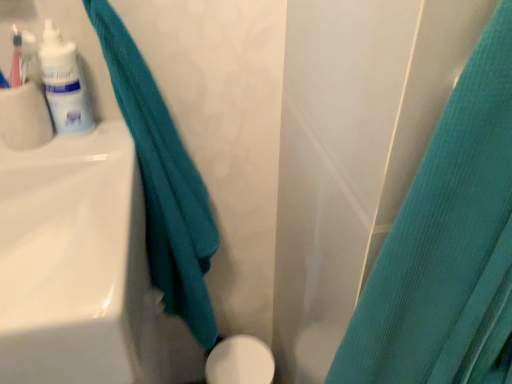
The image size is (512, 384). Identify the location of teal fabric towel at left, the 1th curtain positioned from the left. (163, 183).

Consider the image. Could you measure the distance between teal fabric curtain at right, which is the 2th curtain from left to right, and white glossy porcelain at lower center?

teal fabric curtain at right, which is the 2th curtain from left to right, is 66.66 centimeters away from white glossy porcelain at lower center.

From the image's perspective, which is above, teal fabric curtain at right, which is the first curtain from right to left, or white glossy porcelain at lower center?

teal fabric curtain at right, which is the first curtain from right to left, is shown above in the image.

Does teal fabric curtain at right, which is the 2th curtain from left to right, have a lesser width compared to white glossy porcelain at lower center?

No, teal fabric curtain at right, which is the 2th curtain from left to right, is not thinner than white glossy porcelain at lower center.

The width and height of the screenshot is (512, 384). I want to click on curtain lying on the right of white glossy porcelain at lower center, so click(447, 245).

From the image's perspective, is teal fabric curtain at right, which is the 2th curtain from left to right, located above or below white glossy sink at left?

teal fabric curtain at right, which is the 2th curtain from left to right, is below white glossy sink at left.

Considering the positions of objects teal fabric curtain at right, which is the 2th curtain from left to right, and white glossy sink at left in the image provided, who is more to the left, teal fabric curtain at right, which is the 2th curtain from left to right, or white glossy sink at left?

white glossy sink at left is more to the left.

Is point (459, 186) closer to viewer compared to point (35, 287)?

Yes, point (459, 186) is closer to viewer.

From a real-world perspective, is teal fabric curtain at right, which is the 2th curtain from left to right, above or below white glossy sink at left?

From a real-world perspective, teal fabric curtain at right, which is the 2th curtain from left to right, is physically above white glossy sink at left.

Which object is wider, teal fabric towel at left, the second curtain in the right-to-left sequence, or white glossy sink at left?

Wider between the two is white glossy sink at left.

What are the coordinates of `sink on the left of teal fabric towel at left, the second curtain in the right-to-left sequence` in the screenshot? It's located at (72, 260).

Can you confirm if teal fabric towel at left, the second curtain in the right-to-left sequence, is smaller than white glossy sink at left?

Actually, teal fabric towel at left, the second curtain in the right-to-left sequence, might be larger than white glossy sink at left.

Considering the sizes of teal fabric towel at left, the second curtain in the right-to-left sequence, and white glossy sink at left in the image, is teal fabric towel at left, the second curtain in the right-to-left sequence, taller or shorter than white glossy sink at left?

Clearly, teal fabric towel at left, the second curtain in the right-to-left sequence, is taller compared to white glossy sink at left.

Looking at this image, is white glossy sink at left next to white glossy lotion at upper left?

white glossy sink at left and white glossy lotion at upper left are clearly separated.

From a real-world perspective, is white glossy sink at left on top of white glossy lotion at upper left?

No, from a real-world perspective, white glossy sink at left is not on top of white glossy lotion at upper left.

Is white glossy sink at left oriented towards white glossy lotion at upper left?

No, white glossy sink at left does not turn towards white glossy lotion at upper left.

Measure the distance between white glossy sink at left and white glossy lotion at upper left.

white glossy sink at left and white glossy lotion at upper left are 7.96 inches apart.

Can you confirm if teal fabric towel at left, the second curtain in the right-to-left sequence, is smaller than white glossy lotion at upper left?

No, teal fabric towel at left, the second curtain in the right-to-left sequence, is not smaller than white glossy lotion at upper left.

Which is behind, point (135, 66) or point (61, 85)?

The point (135, 66) is farther from the camera.

Is teal fabric towel at left, the second curtain in the right-to-left sequence, completely or partially outside of white glossy lotion at upper left?

That's correct, teal fabric towel at left, the second curtain in the right-to-left sequence, is outside of white glossy lotion at upper left.

Consider the image. Are teal fabric towel at left, the 1th curtain positioned from the left, and white glossy lotion at upper left beside each other?

No, teal fabric towel at left, the 1th curtain positioned from the left, is not next to white glossy lotion at upper left.

Which object is wider, white glossy sink at left or teal fabric towel at left, the 1th curtain positioned from the left?

Wider between the two is white glossy sink at left.

Is white glossy sink at left smaller than teal fabric towel at left, the second curtain in the right-to-left sequence?

Indeed, white glossy sink at left has a smaller size compared to teal fabric towel at left, the second curtain in the right-to-left sequence.

Is point (0, 232) positioned before point (210, 325)?

Yes.

How different are the orientations of white glossy sink at left and teal fabric towel at left, the second curtain in the right-to-left sequence, in degrees?

0.000115 degrees.

From the image's perspective, would you say teal fabric towel at left, the 1th curtain positioned from the left, is positioned over white glossy porcelain at lower center?

Yes, from the image's perspective, teal fabric towel at left, the 1th curtain positioned from the left, is on top of white glossy porcelain at lower center.

How much distance is there between teal fabric towel at left, the 1th curtain positioned from the left, and white glossy porcelain at lower center?

teal fabric towel at left, the 1th curtain positioned from the left, and white glossy porcelain at lower center are 16.30 inches apart.

Between teal fabric towel at left, the second curtain in the right-to-left sequence, and white glossy porcelain at lower center, which one has less height?

white glossy porcelain at lower center.

Which is correct: teal fabric towel at left, the second curtain in the right-to-left sequence, is inside white glossy porcelain at lower center, or outside of it?

teal fabric towel at left, the second curtain in the right-to-left sequence, is not inside white glossy porcelain at lower center, it's outside.

This screenshot has width=512, height=384. In order to click on porcelain located below the teal fabric curtain at right, which is the first curtain from right to left (from the image's perspective) in this screenshot , I will do `click(240, 362)`.

Identify the location of sink above the teal fabric curtain at right, which is the first curtain from right to left (from the image's perspective). This screenshot has width=512, height=384. (72, 260).

Which object lies further to the anchor point teal fabric towel at left, the 1th curtain positioned from the left, white glossy sink at left or white glossy lotion at upper left?

white glossy lotion at upper left.

Based on their spatial positions, is teal fabric towel at left, the second curtain in the right-to-left sequence, or white glossy lotion at upper left closer to teal fabric curtain at right, which is the first curtain from right to left?

teal fabric towel at left, the second curtain in the right-to-left sequence.

In the scene shown: Based on their spatial positions, is white glossy sink at left or white glossy lotion at upper left closer to white glossy porcelain at lower center?

The object closer to white glossy porcelain at lower center is white glossy sink at left.

Which object lies nearer to the anchor point white glossy lotion at upper left, teal fabric towel at left, the 1th curtain positioned from the left, or white glossy sink at left?

Based on the image, teal fabric towel at left, the 1th curtain positioned from the left, appears to be nearer to white glossy lotion at upper left.

Estimate the real-world distances between objects in this image. Which object is further from white glossy lotion at upper left, white glossy sink at left or teal fabric curtain at right, which is the 2th curtain from left to right?

Among the two, teal fabric curtain at right, which is the 2th curtain from left to right, is located further to white glossy lotion at upper left.

Estimate the real-world distances between objects in this image. Which object is further from teal fabric towel at left, the 1th curtain positioned from the left, white glossy lotion at upper left or white glossy porcelain at lower center?

white glossy porcelain at lower center.

Estimate the real-world distances between objects in this image. Which object is further from white glossy lotion at upper left, teal fabric curtain at right, which is the first curtain from right to left, or teal fabric towel at left, the 1th curtain positioned from the left?

teal fabric curtain at right, which is the first curtain from right to left, is positioned further to the anchor white glossy lotion at upper left.

Which object lies nearer to the anchor point white glossy lotion at upper left, white glossy sink at left or white glossy porcelain at lower center?

Among the two, white glossy sink at left is located nearer to white glossy lotion at upper left.

Find the location of `toiletry situated between white glossy sink at left and teal fabric curtain at right, which is the first curtain from right to left, from left to right`. toiletry situated between white glossy sink at left and teal fabric curtain at right, which is the first curtain from right to left, from left to right is located at coordinates (64, 83).

Locate an element on the screen. Image resolution: width=512 pixels, height=384 pixels. sink between teal fabric curtain at right, which is the 2th curtain from left to right, and white glossy porcelain at lower center from front to back is located at coordinates (72, 260).

Where is `sink between white glossy lotion at upper left and white glossy porcelain at lower center vertically`? The height and width of the screenshot is (384, 512). sink between white glossy lotion at upper left and white glossy porcelain at lower center vertically is located at coordinates (72, 260).

Where is `curtain situated between white glossy lotion at upper left and teal fabric curtain at right, which is the 2th curtain from left to right, from left to right`? curtain situated between white glossy lotion at upper left and teal fabric curtain at right, which is the 2th curtain from left to right, from left to right is located at coordinates (163, 183).